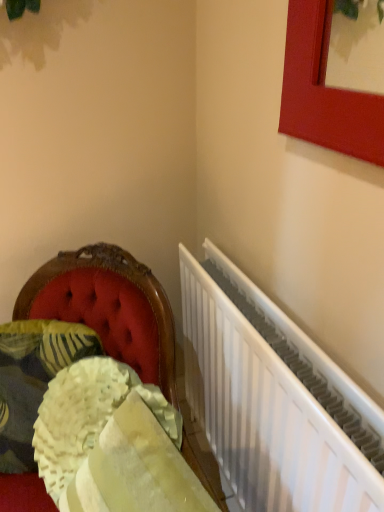
Identify the location of fluffy cream cushion at lower left. The height and width of the screenshot is (512, 384). (88, 416).

Measure the distance between point (39, 412) and camera.

They are 1.19 meters apart.

Find the location of a particular element. Image resolution: width=384 pixels, height=512 pixels. fluffy white pillow at lower left is located at coordinates (33, 379).

What is the approximate height of velvet cushion at left?

velvet cushion at left is 19.13 inches tall.

The image size is (384, 512). What are the coordinates of `fluffy cream cushion at lower left` in the screenshot? It's located at (88, 416).

Who is more distant, fluffy white pillow at lower left or white metallic radiator at right?

fluffy white pillow at lower left is more distant.

In the scene shown: Between fluffy white pillow at lower left and white metallic radiator at right, which one appears on the left side from the viewer's perspective?

Positioned to the left is fluffy white pillow at lower left.

From the image's perspective, is fluffy white pillow at lower left located above or below white metallic radiator at right?

fluffy white pillow at lower left is situated higher than white metallic radiator at right in the image.

Is fluffy white pillow at lower left not within white metallic radiator at right?

Yes, fluffy white pillow at lower left is outside of white metallic radiator at right.

From the picture: From a real-world perspective, which object rests below the other?

velvet cushion at left is physically lower.

Choose the correct answer: Is fluffy white pillow at lower left inside velvet cushion at left or outside it?

fluffy white pillow at lower left lies within the bounds of velvet cushion at left.

From the image's perspective, which is above, fluffy white pillow at lower left or velvet cushion at left?

fluffy white pillow at lower left, from the image's perspective.

Is fluffy white pillow at lower left wider than velvet cushion at left?

Incorrect, the width of fluffy white pillow at lower left does not surpass that of velvet cushion at left.

In the scene shown: Is velvet cushion at left positioned with its back to white metallic radiator at right?

Yes.

Is velvet cushion at left bigger than white metallic radiator at right?

Actually, velvet cushion at left might be smaller than white metallic radiator at right.

From a real-world perspective, which object stands above the other?

In real-world perspective, velvet cushion at left is above.

From the image's perspective, which is below, velvet cushion at left or white metallic radiator at right?

From the image's view, velvet cushion at left is below.

Is velvet cushion at left next to fluffy cream cushion at lower left?

No, velvet cushion at left is not making contact with fluffy cream cushion at lower left.

Based on their sizes in the image, would you say velvet cushion at left is bigger or smaller than fluffy cream cushion at lower left?

Clearly, velvet cushion at left is smaller in size than fluffy cream cushion at lower left.

From the image's perspective, between velvet cushion at left and fluffy cream cushion at lower left, which one is located above?

velvet cushion at left is shown above in the image.

Consider the image. From a real-world perspective, which object stands above the other?

fluffy cream cushion at lower left is physically above.

Which is more to the left, fluffy cream cushion at lower left or velvet cushion at left?

velvet cushion at left is more to the left.

Considering the relative sizes of fluffy cream cushion at lower left and velvet cushion at left in the image provided, is fluffy cream cushion at lower left bigger than velvet cushion at left?

Correct, fluffy cream cushion at lower left is larger in size than velvet cushion at left.

In the scene shown: Between white metallic radiator at right and fluffy cream cushion at lower left, which one has smaller size?

Smaller between the two is fluffy cream cushion at lower left.

Is white metallic radiator at right to the left or to the right of fluffy cream cushion at lower left in the image?

white metallic radiator at right is positioned on fluffy cream cushion at lower left's right side.

Find the location of `material below the white metallic radiator at right (from the image's perspective)`. material below the white metallic radiator at right (from the image's perspective) is located at coordinates click(x=88, y=416).

Is fluffy cream cushion at lower left turned away from fluffy white pillow at lower left?

That's not correct — fluffy cream cushion at lower left is not looking away from fluffy white pillow at lower left.

Looking at this image, who is taller, fluffy cream cushion at lower left or fluffy white pillow at lower left?

fluffy cream cushion at lower left is taller.

Can you confirm if fluffy cream cushion at lower left is wider than fluffy white pillow at lower left?

Yes.

This screenshot has height=512, width=384. What are the coordinates of `pillow on the left of white metallic radiator at right` in the screenshot? It's located at pos(33,379).

Locate an element on the screen. The image size is (384, 512). furniture in front of the fluffy white pillow at lower left is located at coordinates (109, 307).

From the image, which object appears to be farther from fluffy cream cushion at lower left, fluffy white pillow at lower left or velvet cushion at left?

Among the two, velvet cushion at left is located further to fluffy cream cushion at lower left.

From the image, which object appears to be nearer to velvet cushion at left, fluffy cream cushion at lower left or fluffy white pillow at lower left?

fluffy white pillow at lower left is positioned closer to the anchor velvet cushion at left.

Considering their positions, is white metallic radiator at right positioned closer to velvet cushion at left than fluffy white pillow at lower left?

fluffy white pillow at lower left is closer to velvet cushion at left.

Considering their positions, is fluffy white pillow at lower left positioned further to velvet cushion at left than fluffy cream cushion at lower left?

fluffy cream cushion at lower left lies further to velvet cushion at left than the other object.

Considering their positions, is velvet cushion at left positioned further to fluffy cream cushion at lower left than white metallic radiator at right?

The object further to fluffy cream cushion at lower left is white metallic radiator at right.

When comparing their distances from velvet cushion at left, does white metallic radiator at right or fluffy cream cushion at lower left seem further?

Based on the image, white metallic radiator at right appears to be further to velvet cushion at left.

Based on their spatial positions, is velvet cushion at left or white metallic radiator at right further from fluffy white pillow at lower left?

white metallic radiator at right lies further to fluffy white pillow at lower left than the other object.

When comparing their distances from fluffy cream cushion at lower left, does fluffy white pillow at lower left or white metallic radiator at right seem further?

Based on the image, white metallic radiator at right appears to be further to fluffy cream cushion at lower left.

Identify the location of furniture between fluffy cream cushion at lower left and fluffy white pillow at lower left along the z-axis. (109, 307).

Find the location of a particular element. This screenshot has width=384, height=512. material situated between velvet cushion at left and white metallic radiator at right from left to right is located at coordinates (88, 416).

Identify the location of furniture situated between fluffy white pillow at lower left and white metallic radiator at right from left to right. (109, 307).

You are a GUI agent. You are given a task and a screenshot of the screen. Output one action in this format:
    pyautogui.click(x=<x>, y=<y>)
    Task: Click on the material between fluffy white pillow at lower left and white metallic radiator at right from left to right
    The height and width of the screenshot is (512, 384).
    Given the screenshot: What is the action you would take?
    pyautogui.click(x=88, y=416)